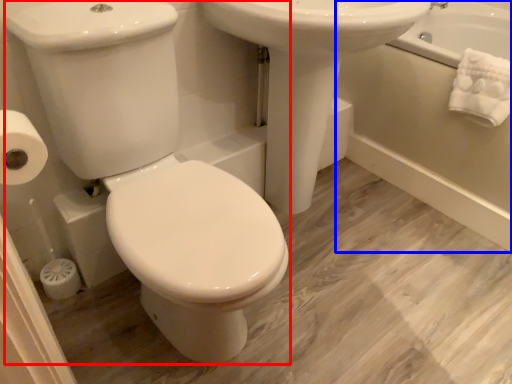
Question: Which object is closer to the camera taking this photo, porcelain (highlighted by a red box) or bath (highlighted by a blue box)?

Choices:
 (A) porcelain
 (B) bath

Answer: (A)